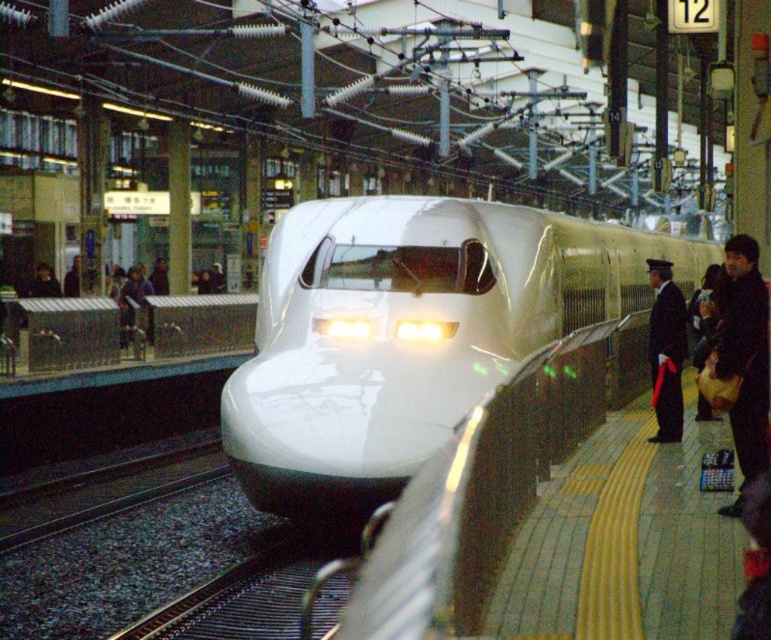
You are a passenger waiting on the platform and see both the dark gray fabric jacket at right and the dark blue uniform at right. Which person is closer to you?

The dark gray fabric jacket at right is closer to you because it is in front of the dark blue uniform at right.

You are a photographer standing on the platform. You want to take a photo of the white glossy bullet train at center and the dark gray fabric jacket at right in the same frame. Which object should you focus on first to ensure both are in focus?

The white glossy bullet train at center is larger in size compared to the dark gray fabric jacket at right, so you should focus on the white glossy bullet train at center first to ensure both are in focus.

You are a passenger waiting on the platform and see the white glossy bullet train at center and the dark blue uniform at right. Which object is taller?

The white glossy bullet train at center is taller than the dark blue uniform at right.